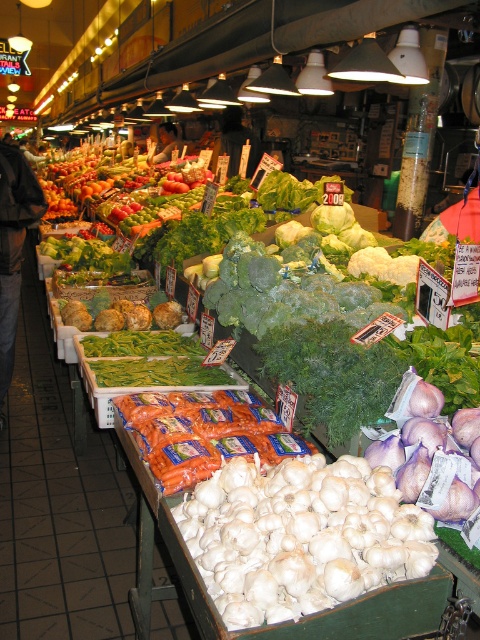
You are a customer at the market and want to place the white matte garlic at lower center on top of the dark blue jeans at lower left. Is there enough space for the garlic to fit without hanging over the edges?

The white matte garlic at lower center might be wider than dark blue jeans at lower left, so there is a possibility that it will hang over the edges. Check the exact dimensions before placing it.

You are a customer in the market and want to place the white matte garlic at lower center on top of the dark blue jeans at lower left. Is this possible based on their heights?

The white matte garlic at lower center is not as tall as dark blue jeans at lower left, so it can be placed on top of them since it is shorter.